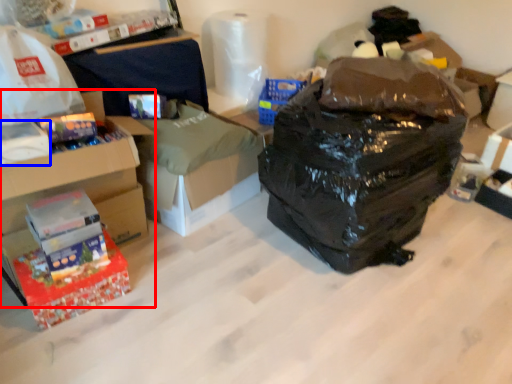
Question: Which object is further to the camera taking this photo, box (highlighted by a red box) or box (highlighted by a blue box)?

Choices:
 (A) box
 (B) box

Answer: (A)